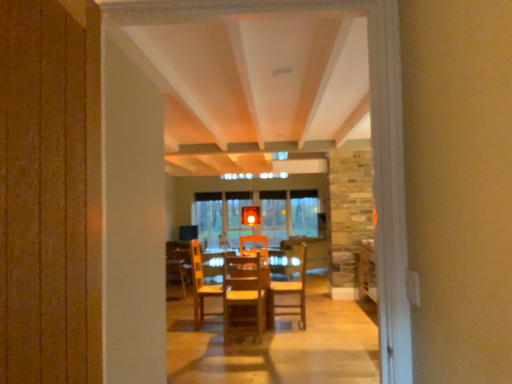
In order to click on wooden chair at center, which ranks as the 2th chair in back-to-front order in this screenshot , I will do `click(245, 293)`.

Find the location of a particular element. This screenshot has width=512, height=384. wooden chair at center, which is counted as the first chair, starting from the front is located at coordinates (245, 293).

Between wooden chairs at center and wooden chair at center, the 2th chair positioned from the front, which one has less height?

wooden chairs at center.

Visually, is wooden chairs at center positioned to the left or to the right of wooden chair at center, the first chair positioned from the back?

In the image, wooden chairs at center appears on the left side of wooden chair at center, the first chair positioned from the back.

Which is closer, (286, 380) or (292, 312)?

The point (286, 380) is closer.

How far apart are wooden chair at center, the first chair positioned from the back, and wooden chair at center, which appears as the first chair when viewed from the left?

A distance of 21.43 inches exists between wooden chair at center, the first chair positioned from the back, and wooden chair at center, which appears as the first chair when viewed from the left.

Does wooden chair at center, the second chair from the left, turn towards wooden chair at center, the 2th chair positioned from the right?

No, wooden chair at center, the second chair from the left, is not aimed at wooden chair at center, the 2th chair positioned from the right.

Considering the positions of objects wooden chair at center, the 2th chair positioned from the front, and wooden chair at center, which appears as the first chair when viewed from the left, in the image provided, who is more to the right, wooden chair at center, the 2th chair positioned from the front, or wooden chair at center, which appears as the first chair when viewed from the left,?

wooden chair at center, the 2th chair positioned from the front.

This screenshot has width=512, height=384. Identify the location of chair that is below the wooden chair at center, which ranks as the 2th chair in back-to-front order (from the image's perspective). (292, 292).

From the image's perspective, would you say wooden table at center is shown under wooden chair at center, which is counted as the first chair, starting from the front?

Yes.

Is wooden table at center beside wooden chair at center, the 2th chair positioned from the right?

wooden table at center and wooden chair at center, the 2th chair positioned from the right, are clearly separated.

Is wooden table at center further to the viewer compared to wooden chair at center, which appears as the first chair when viewed from the left?

Yes, the depth of wooden table at center is greater than that of wooden chair at center, which appears as the first chair when viewed from the left.

Is wooden chair at center, which ranks as the 2th chair in back-to-front order, facing towards wooden table at center?

Yes, wooden chair at center, which ranks as the 2th chair in back-to-front order, is aimed at wooden table at center.

From a real-world perspective, relative to wooden table at center, is wooden chair at center, which is counted as the first chair, starting from the front, vertically above or below?

In terms of real-world spatial position, wooden chair at center, which is counted as the first chair, starting from the front, is above wooden table at center.

Between wooden chair at center, which appears as the first chair when viewed from the left, and wooden table at center, which one has smaller size?

With smaller size is wooden chair at center, which appears as the first chair when viewed from the left.

Is point (223, 289) closer or farther from the camera than point (199, 304)?

Point (223, 289) appears to be closer to the viewer than point (199, 304).

Is wooden chair at center, which is counted as the first chair, starting from the front, far from wooden chair at center, the first chair positioned from the right?

They are positioned close to each other.

From the image's perspective, is wooden chair at center, which ranks as the 2th chair in back-to-front order, beneath wooden chair at center, the first chair positioned from the back?

Incorrect, from the image's perspective, wooden chair at center, which ranks as the 2th chair in back-to-front order, is higher than wooden chair at center, the first chair positioned from the back.

From a real-world perspective, relative to wooden chair at center, the 2th chair positioned from the front, is wooden chair at center, which is counted as the first chair, starting from the front, vertically above or below?

From a real-world perspective, wooden chair at center, which is counted as the first chair, starting from the front, is physically above wooden chair at center, the 2th chair positioned from the front.

Is wooden armchair at center shorter than wooden chair at center, which ranks as the 2th chair in back-to-front order?

Yes, wooden armchair at center is shorter than wooden chair at center, which ranks as the 2th chair in back-to-front order.

Is wooden armchair at center to the left of wooden chair at center, which ranks as the 2th chair in back-to-front order, from the viewer's perspective?

Correct, you'll find wooden armchair at center to the left of wooden chair at center, which ranks as the 2th chair in back-to-front order.

Is point (179, 261) behind point (264, 306)?

Yes, point (179, 261) is farther from viewer.

From the image's perspective, between wooden armchair at center and wooden chair at center, which is counted as the first chair, starting from the front, which one is located above?

wooden chair at center, which is counted as the first chair, starting from the front, from the image's perspective.

From the image's perspective, between wooden armchair at center and wooden table at center, which one is located above?

From the image's view, wooden table at center is above.

Between wooden armchair at center and wooden table at center, which one is positioned behind?

wooden armchair at center is further from the camera.

From a real-world perspective, does wooden armchair at center sit lower than wooden table at center?

No, from a real-world perspective, wooden armchair at center is not under wooden table at center.

Does wooden armchair at center have a greater width compared to wooden table at center?

In fact, wooden armchair at center might be narrower than wooden table at center.

Locate an element on the screen. This screenshot has width=512, height=384. path located in front of the wooden chair at center, the first chair positioned from the right is located at coordinates pyautogui.click(x=277, y=346).

In order to click on chair that appears on the right of wooden chair at center, the 2th chair positioned from the right in this screenshot , I will do `click(292, 292)`.

In the scene shown: Estimate the real-world distances between objects in this image. Which object is further from wooden chairs at center, wooden table at center or wooden armchair at center?

The object further to wooden chairs at center is wooden armchair at center.

Considering their positions, is wooden armchair at center positioned closer to wooden chairs at center than wooden table at center?

Based on the image, wooden table at center appears to be nearer to wooden chairs at center.

Considering their positions, is wooden table at center positioned further to wooden chair at center, the first chair positioned from the back, than wooden armchair at center?

Based on the image, wooden armchair at center appears to be further to wooden chair at center, the first chair positioned from the back.

Consider the image. Considering their positions, is wooden chair at center, which ranks as the 2th chair in back-to-front order, positioned further to wooden table at center than wooden chair at center, the first chair positioned from the right?

Answer: wooden chair at center, the first chair positioned from the right, is further to wooden table at center.

Which object lies further to the anchor point wooden table at center, wooden chair at center, the second chair from the left, or wooden armchair at center?

wooden chair at center, the second chair from the left, is further to wooden table at center.

When comparing their distances from wooden armchair at center, does wooden chair at center, the first chair positioned from the back, or wooden table at center seem closer?

wooden table at center is closer to wooden armchair at center.

Considering their positions, is wooden chair at center, the second chair from the left, positioned further to wooden table at center than wooden chair at center, the 2th chair positioned from the right?

wooden chair at center, the second chair from the left, is positioned further to the anchor wooden table at center.

Based on their spatial positions, is wooden table at center or wooden chairs at center closer to wooden armchair at center?

wooden table at center is closer to wooden armchair at center.

Find the location of `chair located between wooden table at center and wooden armchair at center in the depth direction`. chair located between wooden table at center and wooden armchair at center in the depth direction is located at coordinates (292, 292).

Identify the location of table between wooden chair at center, which ranks as the 2th chair in back-to-front order, and wooden chair at center, the first chair positioned from the right, in the horizontal direction. This screenshot has width=512, height=384. (200, 285).

Where is `chair between wooden chairs at center and wooden table at center along the z-axis`? The width and height of the screenshot is (512, 384). chair between wooden chairs at center and wooden table at center along the z-axis is located at coordinates 245,293.

The width and height of the screenshot is (512, 384). I want to click on chair between wooden chairs at center and wooden chair at center, the first chair positioned from the back, in the front-back direction, so click(245, 293).